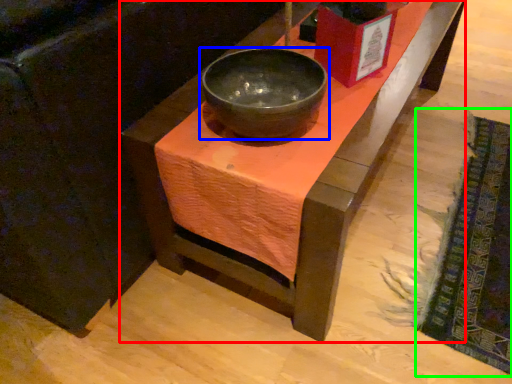
Question: Estimate the real-world distances between objects in this image. Which object is farther from table (highlighted by a red box), bowl (highlighted by a blue box) or mat (highlighted by a green box)?

Choices:
 (A) bowl
 (B) mat

Answer: (B)